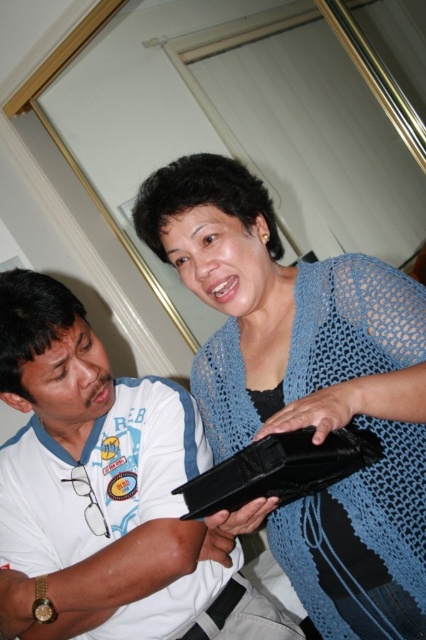
You are a delivery person who needs to place a small package between the blue knitted sweater at center and the white matte shirt at lower left. The package is 10 inches long. Can you fit it between them without moving either clothing item?

The blue knitted sweater at center is 9.65 inches away from the white matte shirt at lower left. Since the package is 10 inches long, it cannot fit between them as the distance is slightly less than the package length.

You are a fashion designer observing two people in an image. You need to determine the spatial relationship between the blue knitted sweater at center and the white matte shirt at lower left. Which one is positioned higher in the image?

The blue knitted sweater at center is located above the white matte shirt at lower left, so it is positioned higher in the image.